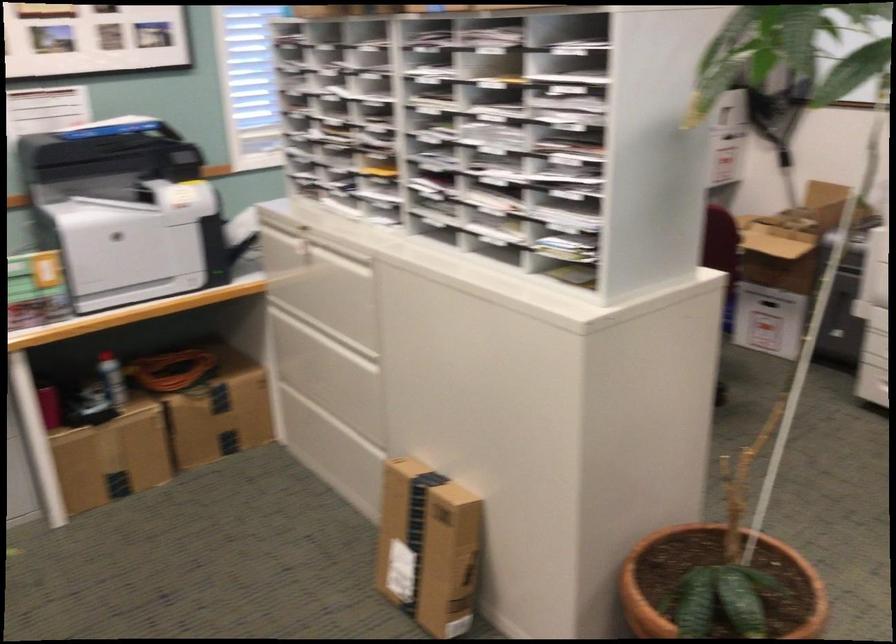
Find the location of a particular element. This screenshot has width=896, height=644. white drawer handle is located at coordinates (291, 252).